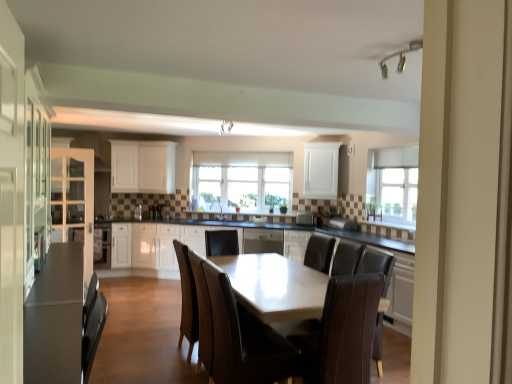
Question: From the image's perspective, is white glossy cabinet at center, placed as the 2th cabinetry when sorted from right to left, positioned above or below white matte cabinet at center, which is the second cabinetry in left-to-right order?

Choices:
 (A) above
 (B) below

Answer: (B)

Question: Considering the positions of white glossy cabinet at center, placed as the 2th cabinetry when sorted from right to left, and white matte cabinet at center, which is the second cabinetry in left-to-right order, in the image, is white glossy cabinet at center, placed as the 2th cabinetry when sorted from right to left, taller or shorter than white matte cabinet at center, which is the second cabinetry in left-to-right order,?

Choices:
 (A) tall
 (B) short

Answer: (B)

Question: Which object is positioned farthest from the white matte cabinet at center, which is the second cabinetry in left-to-right order?

Choices:
 (A) white glossy cabinet at center, the 4th cabinetry from the left
 (B) matte white table at center
 (C) matte gray armchair at center
 (D) matte white cabinet at left, marked as the 5th cabinetry in a right-to-left arrangement
 (E) brown leather chair at center, which is the 1th chair in right-to-left order

Answer: (E)

Question: Based on their relative distances, which object is farther from the brown leather chair at center, positioned as the 2th chair in left-to-right order?

Choices:
 (A) matte white cabinet at left, marked as the 5th cabinetry in a right-to-left arrangement
 (B) clear glass window at upper center, which ranks as the first window in right-to-left order
 (C) brown leather chair at center, the 1th chair positioned from the left
 (D) white matte cabinet at center, which is the second cabinetry in left-to-right order
 (E) clear glass window at center, arranged as the first window when viewed from the left

Answer: (D)